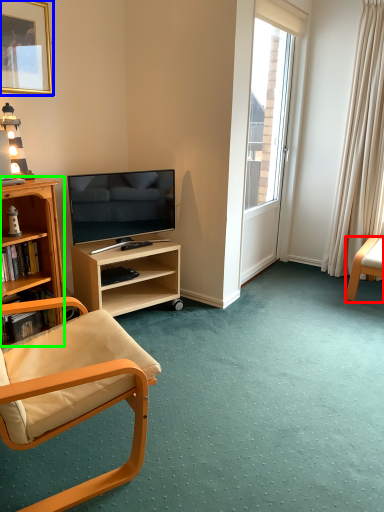
Question: Which is nearer to the chair (highlighted by a red box)? picture frame (highlighted by a blue box) or desk (highlighted by a green box).

Choices:
 (A) picture frame
 (B) desk

Answer: (B)